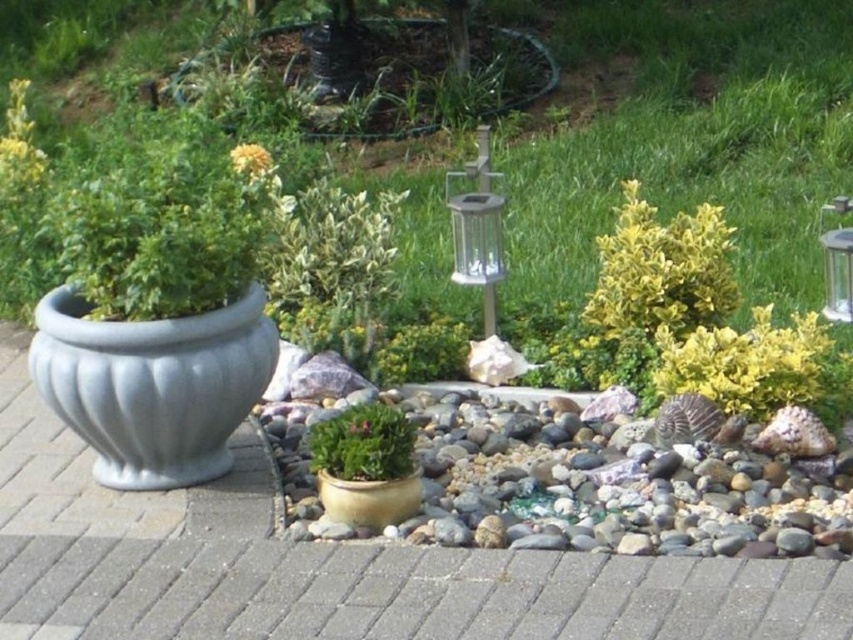
Is matte gold pot at center wider than green leafy plant at upper left?

In fact, matte gold pot at center might be narrower than green leafy plant at upper left.

Measure the distance between matte gold pot at center and camera.

matte gold pot at center and camera are 14.00 feet apart from each other.

Locate an element on the screen. This screenshot has width=853, height=640. matte gold pot at center is located at coordinates (370, 499).

Does point (842, 285) lie in front of point (260, 156)?

Yes, it is in front of point (260, 156).

Can you confirm if metallic glass lantern at upper right is smaller than yellow matte flower at upper center?

Yes.

Locate an element on the screen. The image size is (853, 640). metallic glass lantern at upper right is located at coordinates (837, 273).

Can you confirm if gray matte planter at left is taller than green leafy plant at upper left?

Yes.

Does gray matte planter at left appear on the right side of green leafy plant at upper left?

Correct, you'll find gray matte planter at left to the right of green leafy plant at upper left.

Which is in front, point (256, 320) or point (15, 136)?

Point (256, 320) is in front.

This screenshot has height=640, width=853. Find the location of `gray matte planter at left`. gray matte planter at left is located at coordinates (154, 385).